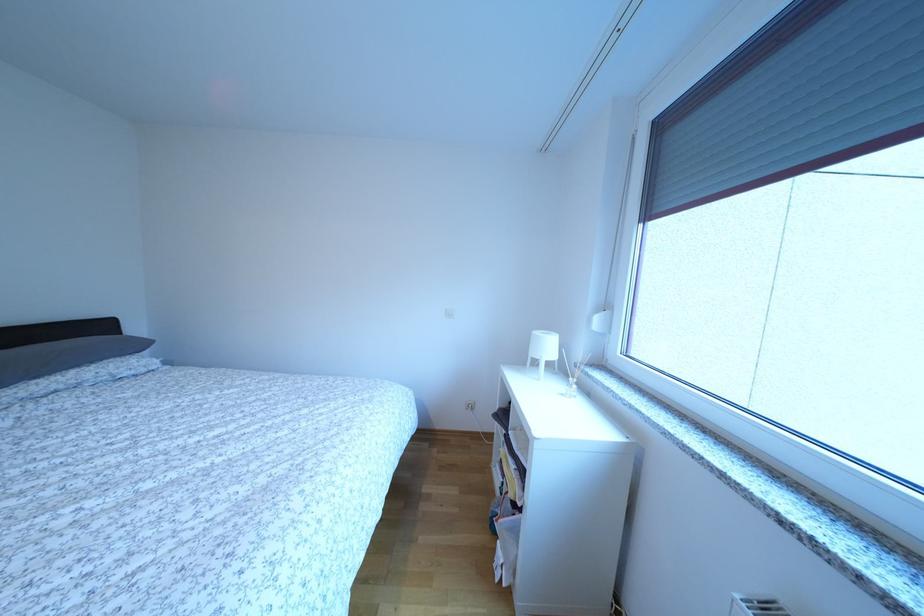
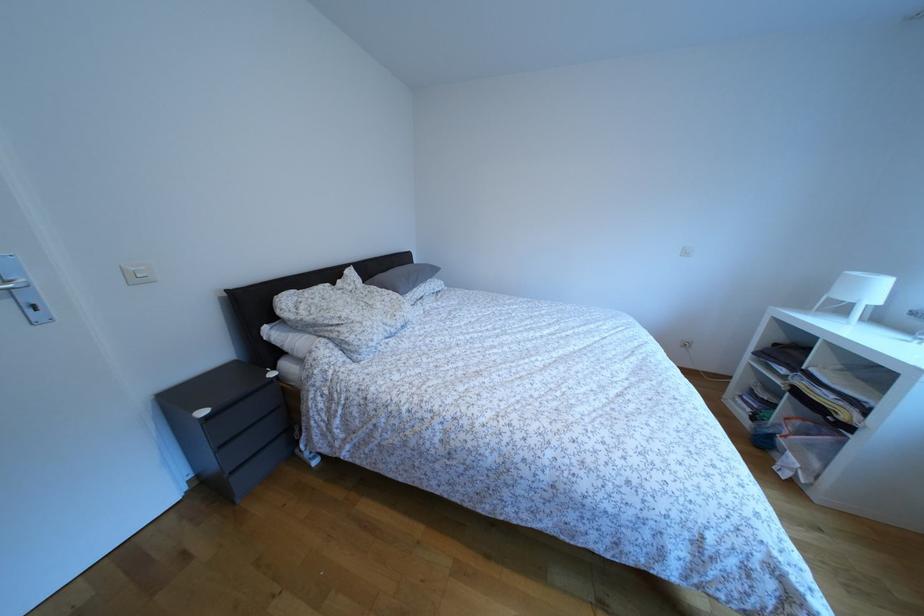
In a continuous first-person perspective shot, in which direction is the camera moving?

The cameraman walked toward left, backward.